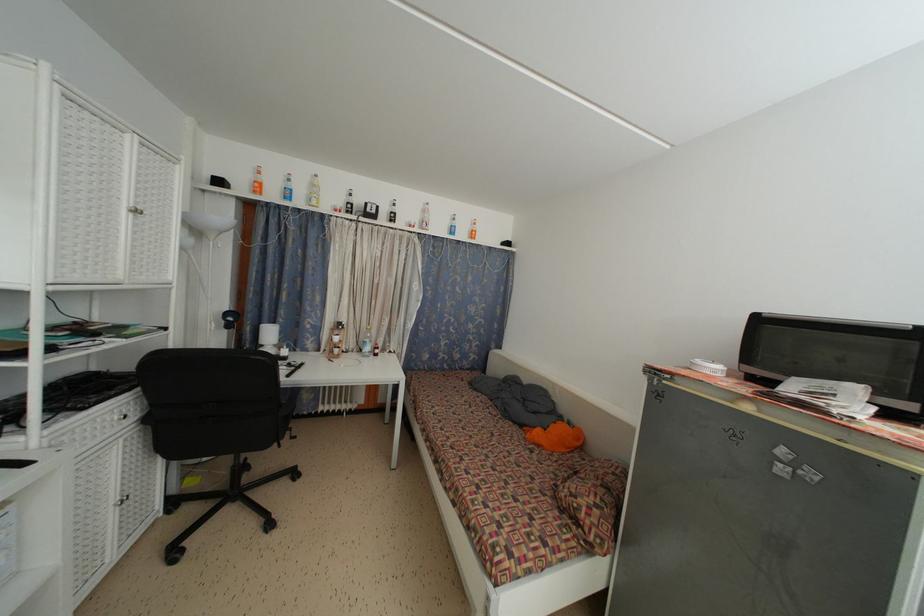
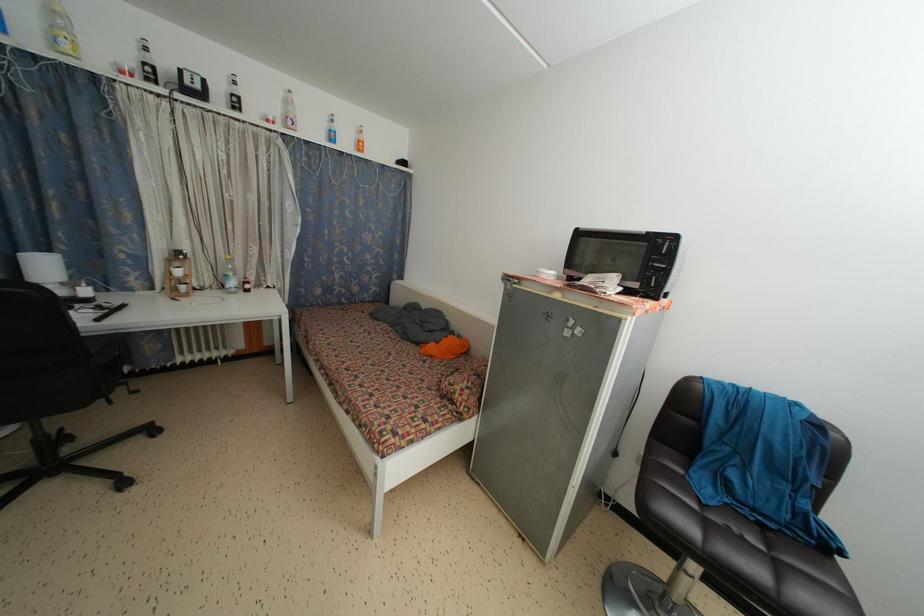
Find the pixel in the second image that matches the point at 396,220 in the first image.

(238, 105)